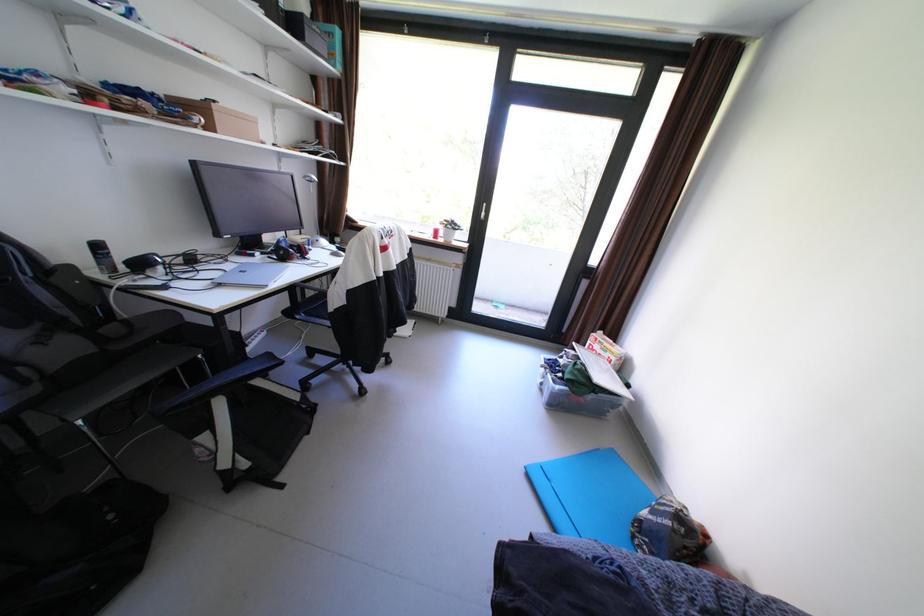
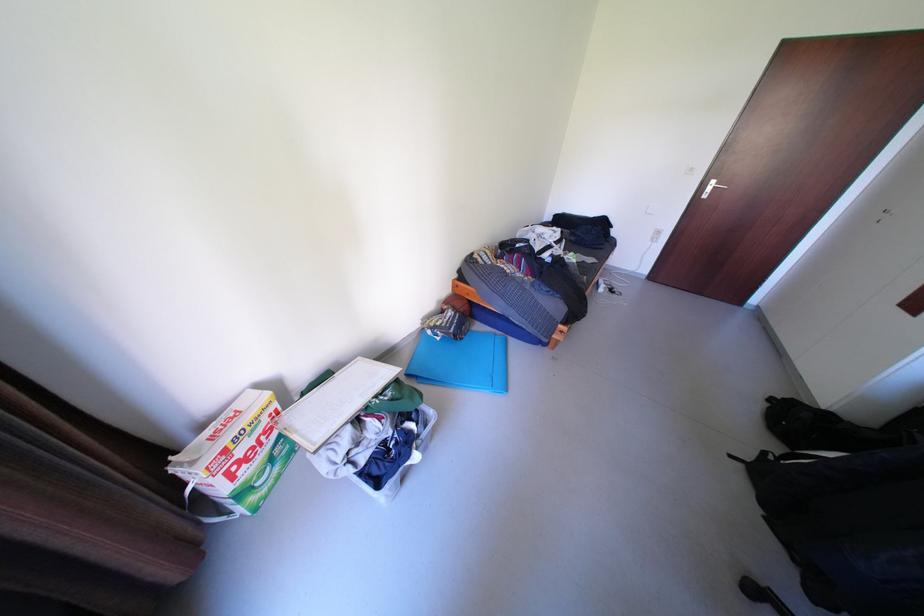
Where in the second image is the point corresponding to pixel 290 477 from the first image?

(752, 466)